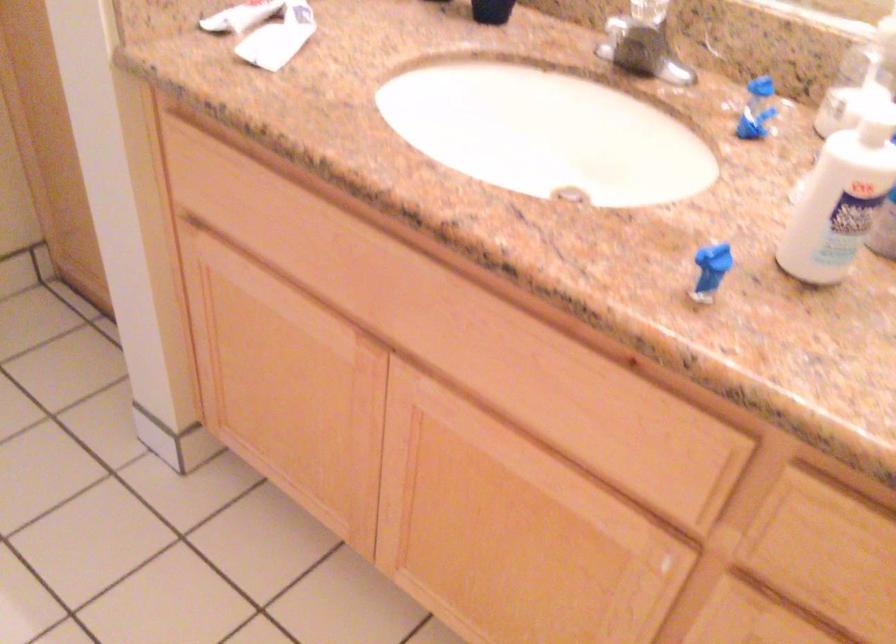
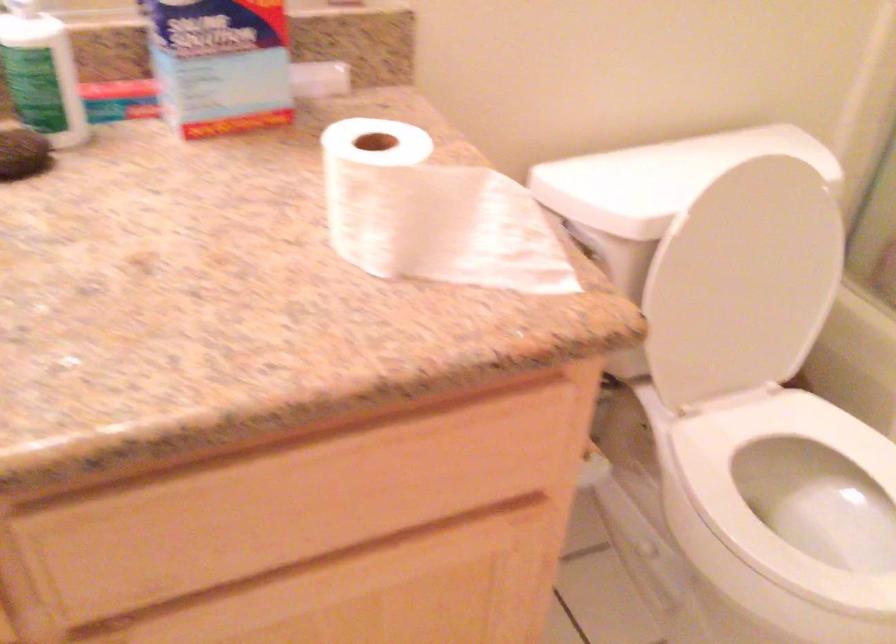
First-person continuous shooting, in which direction is the camera rotating?

The camera's rotation is toward right-down.